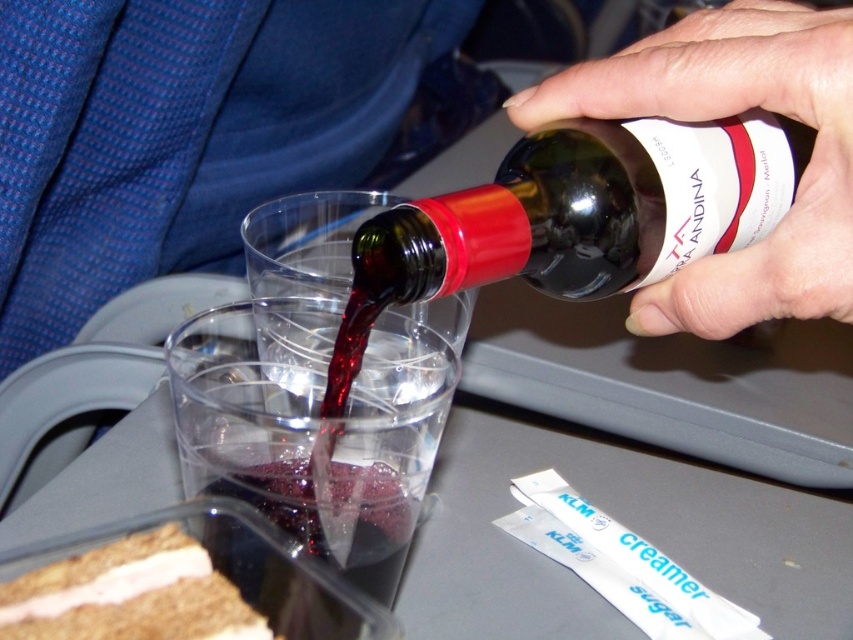
What do you see at coordinates (590, 209) in the screenshot?
I see `dark glass bottle at upper center` at bounding box center [590, 209].

Is dark glass bottle at upper center below smooth skin hand at upper right?

Indeed, dark glass bottle at upper center is positioned under smooth skin hand at upper right.

Which is in front, point (560, 189) or point (651, 81)?

Positioned in front is point (560, 189).

Locate an element on the screen. Image resolution: width=853 pixels, height=640 pixels. dark glass bottle at upper center is located at coordinates (590, 209).

Consider the image. Between dark glass bottle at upper center and brown crumbly cake at lower left, which one has more height?

Standing taller between the two is dark glass bottle at upper center.

Which is behind, point (662, 212) or point (100, 564)?

Positioned behind is point (662, 212).

Is point (572, 182) more distant than point (33, 628)?

Yes, it is.

Locate an element on the screen. This screenshot has width=853, height=640. dark glass bottle at upper center is located at coordinates (590, 209).

Who is lower down, smooth skin hand at upper right or brown crumbly cake at lower left?

brown crumbly cake at lower left

Between smooth skin hand at upper right and brown crumbly cake at lower left, which one has more height?

With more height is smooth skin hand at upper right.

What do you see at coordinates (724, 116) in the screenshot? I see `smooth skin hand at upper right` at bounding box center [724, 116].

Find the location of a particular element. This screenshot has height=640, width=853. smooth skin hand at upper right is located at coordinates (724, 116).